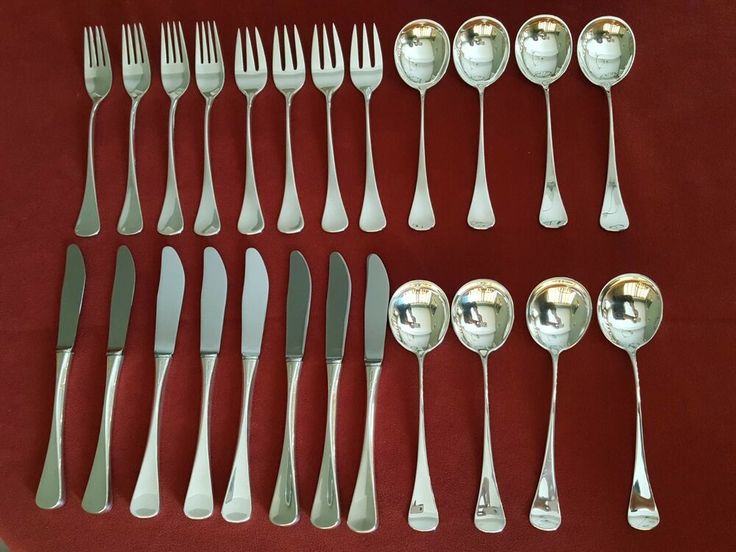
The image size is (736, 552). I want to click on fork, so click(82, 45), click(141, 57), click(174, 66), click(208, 63), click(244, 62), click(283, 61), click(319, 61), click(361, 61).